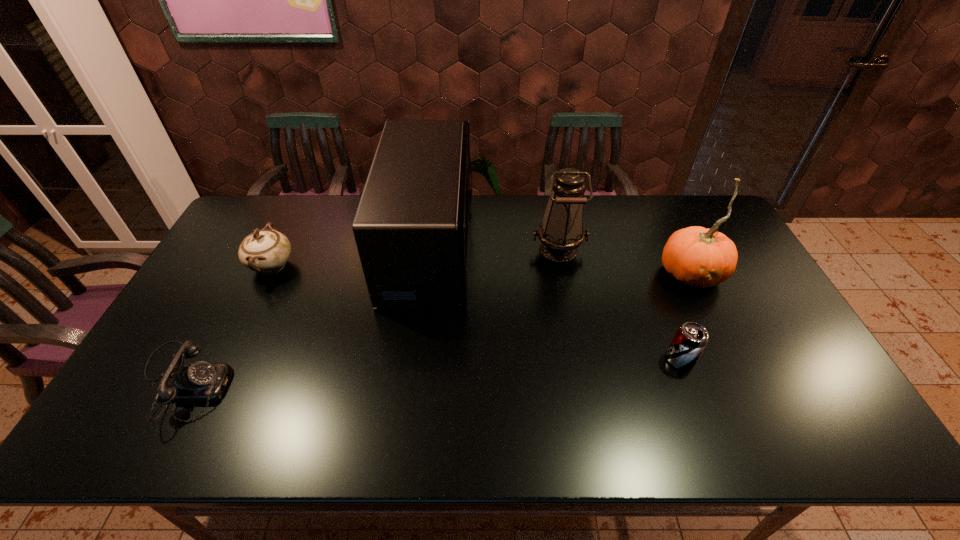
Image resolution: width=960 pixels, height=540 pixels. I want to click on vacant space located 0.160m on the right of the second shortest object, so click(756, 360).

This screenshot has width=960, height=540. What are the coordinates of `free location located 0.110m on the front-facing side of the telephone` in the screenshot? It's located at (274, 383).

The image size is (960, 540). In order to click on microwave_oven situated at the far edge in this screenshot , I will do `click(411, 226)`.

Find the location of `oil lamp positioned at the far edge`. oil lamp positioned at the far edge is located at coordinates (561, 231).

The image size is (960, 540). I want to click on object situated at the near edge, so click(x=201, y=382).

You are a GUI agent. You are given a task and a screenshot of the screen. Output one action in this format:
    pyautogui.click(x=<x>, y=<y>)
    Task: Click on the chinaware located at the left edge
    The width and height of the screenshot is (960, 540).
    Given the screenshot: What is the action you would take?
    pyautogui.click(x=265, y=251)

Identify the location of telephone at the left edge. (201, 382).

The width and height of the screenshot is (960, 540). What are the coordinates of `object that is at the right edge` in the screenshot? It's located at pos(698,257).

I want to click on object at the near left corner, so click(x=201, y=382).

The width and height of the screenshot is (960, 540). I want to click on vacant area at the far edge, so click(511, 199).